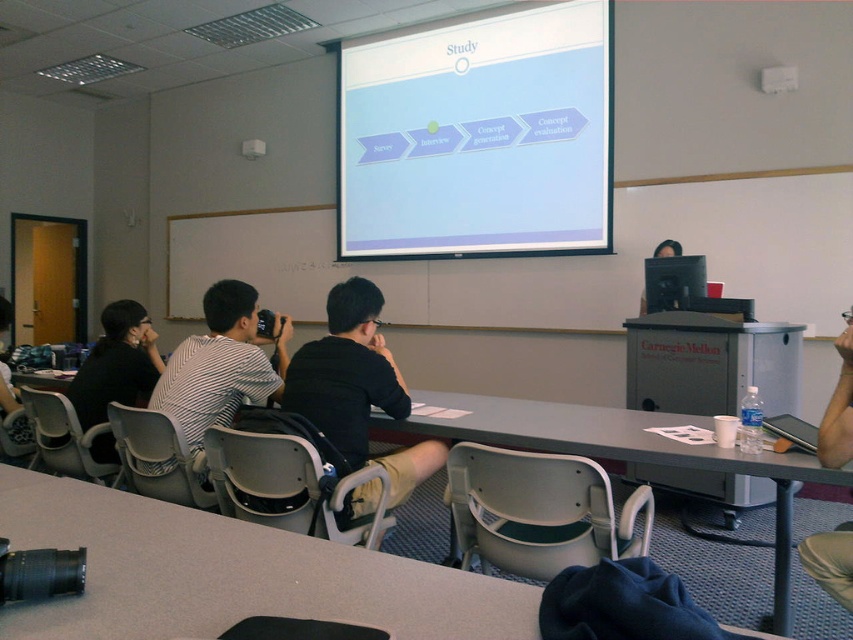
Question: Estimate the real-world distances between objects in this image. Which object is closer to the matte black monitor at upper right?

Choices:
 (A) black matte shirt at center
 (B) black striped shirt at left
 (C) smooth gray table at center

Answer: (A)

Question: Is gray plastic table at center below striped fabric shirt at center?

Choices:
 (A) yes
 (B) no

Answer: (A)

Question: Which of the following is the farthest from the observer?

Choices:
 (A) black matte shirt at center
 (B) black striped shirt at left
 (C) matte black monitor at upper right
 (D) gray plastic table at center

Answer: (C)

Question: Which is nearer to the white glossy projector screen at upper center?

Choices:
 (A) striped fabric shirt at center
 (B) black striped shirt at left
 (C) black matte shirt at center

Answer: (A)

Question: Is black striped shirt at left to the right of matte black monitor at upper right from the viewer's perspective?

Choices:
 (A) no
 (B) yes

Answer: (A)

Question: From the image, what is the correct spatial relationship of striped fabric shirt at center in relation to matte black monitor at upper right?

Choices:
 (A) below
 (B) above

Answer: (A)